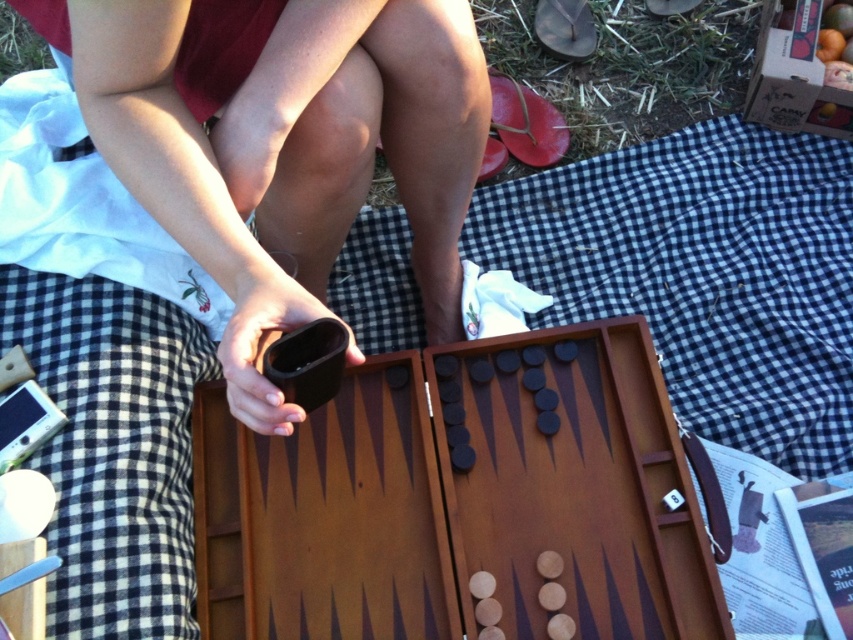
Which is more to the left, matte brown backgammon board at center or brown wooden backgammon board at center?

Positioned to the left is matte brown backgammon board at center.

Which of these two, matte brown backgammon board at center or brown wooden backgammon board at center, stands taller?

With more height is matte brown backgammon board at center.

Does point (318, 204) come in front of point (360, 632)?

That is False.

Where is `matte brown backgammon board at center`? The width and height of the screenshot is (853, 640). matte brown backgammon board at center is located at coordinates (238, 253).